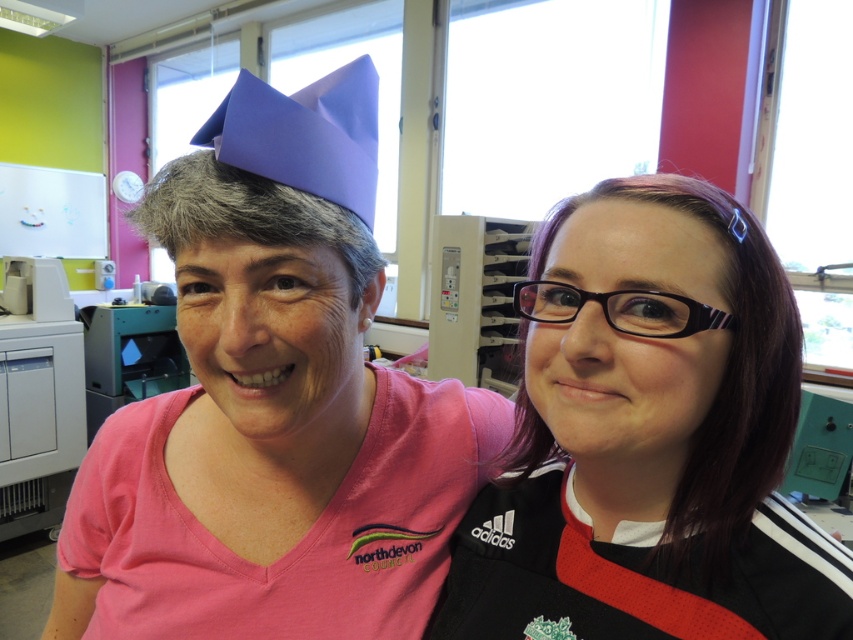
Question: Which of the following is the farthest from the observer?

Choices:
 (A) matte purple paper hat at upper center
 (B) purple paper hat at upper center

Answer: (A)

Question: Which object is closer to the camera taking this photo?

Choices:
 (A) matte purple paper hat at upper center
 (B) purple paper hat at upper center
 (C) matte black glasses at upper right

Answer: (C)

Question: Is matte purple paper hat at upper center wider than matte black glasses at upper right?

Choices:
 (A) yes
 (B) no

Answer: (A)

Question: Among these points, which one is farthest from the camera?

Choices:
 (A) (366, 316)
 (B) (740, 577)
 (C) (273, 106)

Answer: (A)

Question: Does matte black glasses at upper right have a smaller size compared to purple paper hat at upper center?

Choices:
 (A) yes
 (B) no

Answer: (B)

Question: Is matte purple paper hat at upper center below matte black glasses at upper right?

Choices:
 (A) yes
 (B) no

Answer: (A)